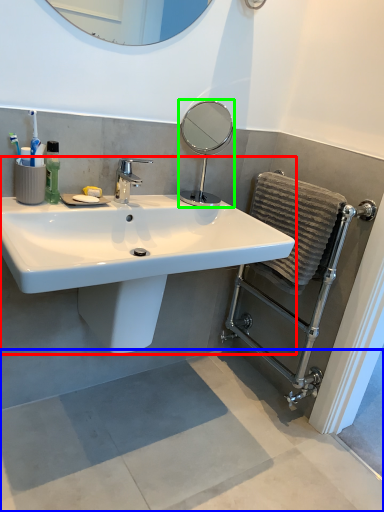
Question: Estimate the real-world distances between objects in this image. Which object is farther from sink (highlighted by a red box), concrete (highlighted by a blue box) or mirror (highlighted by a green box)?

Choices:
 (A) concrete
 (B) mirror

Answer: (B)